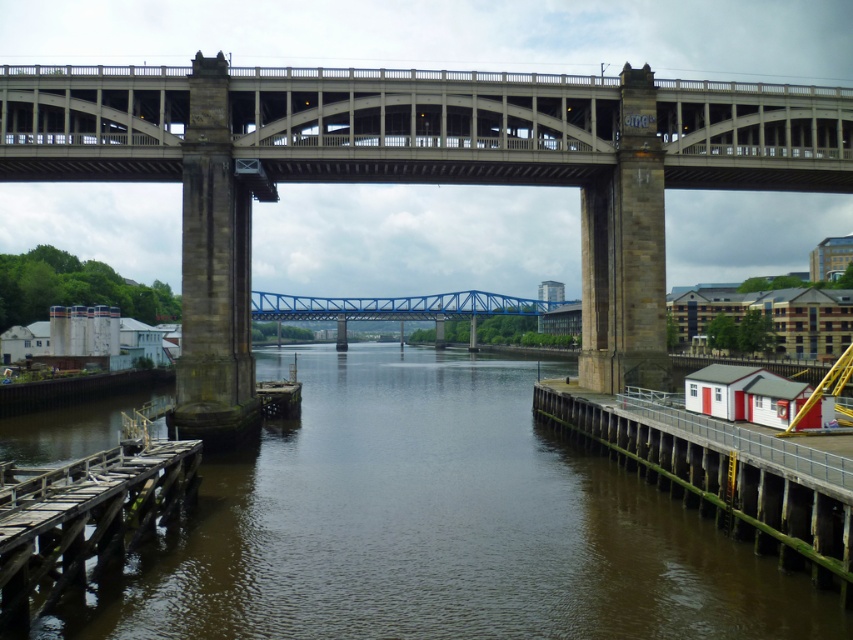
Does point (39, 125) lie behind point (619, 422)?

Yes, point (39, 125) is behind point (619, 422).

Who is positioned more to the left, concrete bridge at center or white wooden dock at right?

From the viewer's perspective, concrete bridge at center appears more on the left side.

Does point (245, 209) come behind point (646, 470)?

Yes.

What are the coordinates of `concrete bridge at center` in the screenshot? It's located at (416, 173).

From the picture: Does concrete bridge at center have a greater height compared to wooden planks dock at lower left?

Yes.

Is concrete bridge at center to the left of wooden planks dock at lower left from the viewer's perspective?

No, concrete bridge at center is not to the left of wooden planks dock at lower left.

This screenshot has height=640, width=853. I want to click on concrete bridge at center, so click(416, 173).

This screenshot has width=853, height=640. Identify the location of concrete bridge at center. (416, 173).

Which is in front, point (677, 604) or point (12, 625)?

Point (12, 625)

Find the location of `brown muddy water at center`. brown muddy water at center is located at coordinates (434, 525).

This screenshot has width=853, height=640. Identify the location of brown muddy water at center. (434, 525).